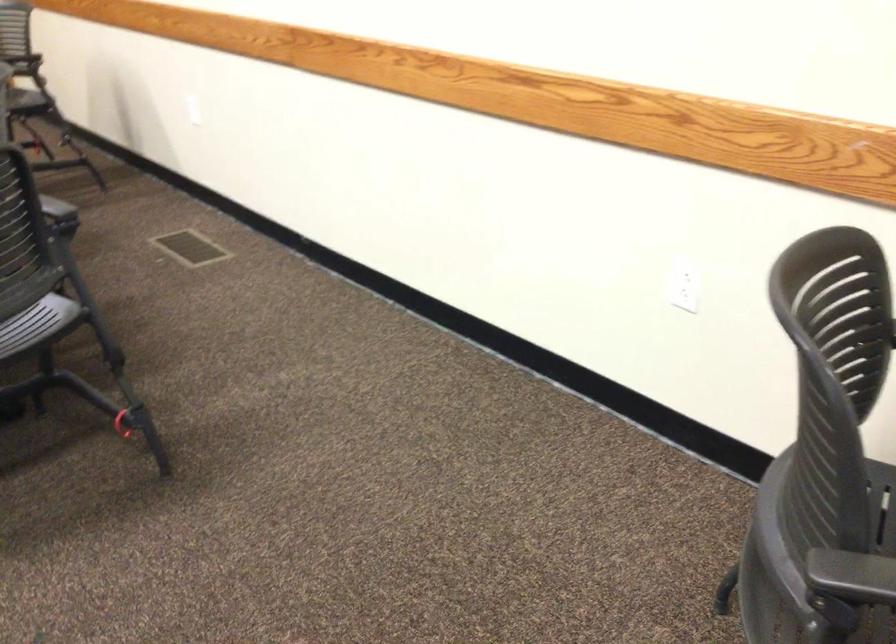
What do you see at coordinates (546, 98) in the screenshot?
I see `the wooden wall handrail` at bounding box center [546, 98].